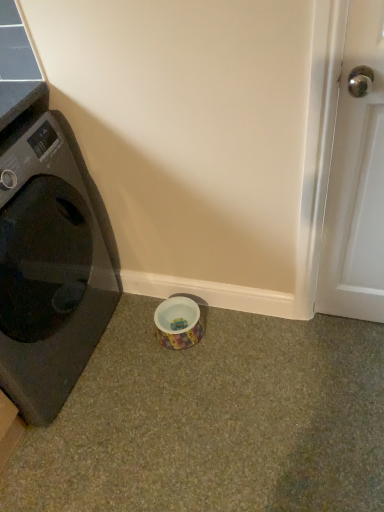
The width and height of the screenshot is (384, 512). I want to click on free space in front of multicolored ceramic bowl at lower center, so click(x=186, y=370).